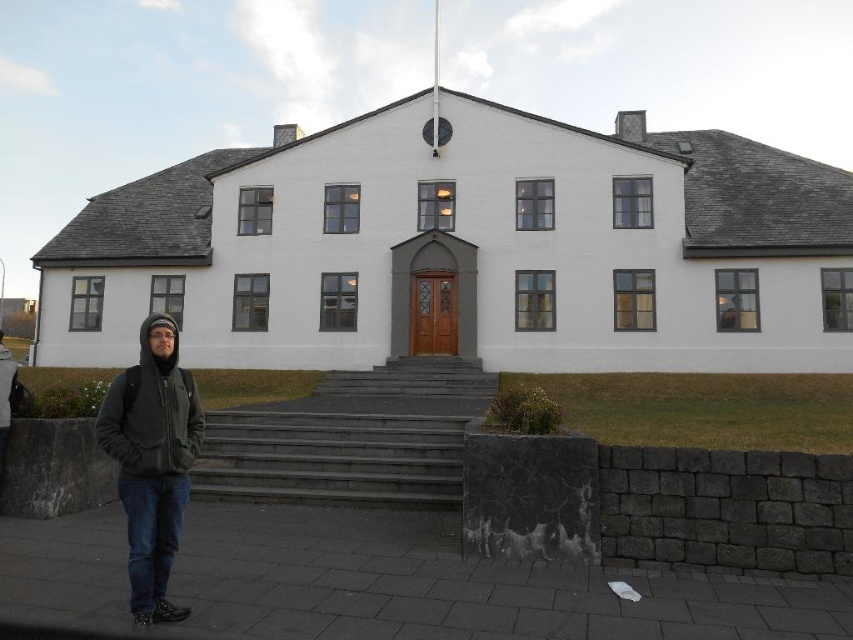
Who is lower down, white matte building at center or dark gray hoodie at lower left?

Positioned lower is dark gray hoodie at lower left.

Is white matte building at center below dark gray hoodie at lower left?

No, white matte building at center is not below dark gray hoodie at lower left.

Which is in front, point (577, 150) or point (189, 385)?

Point (189, 385)

Identify the location of white matte building at center. (x=467, y=248).

Image resolution: width=853 pixels, height=640 pixels. I want to click on white matte building at center, so click(x=467, y=248).

What do you see at coordinates (467, 248) in the screenshot? I see `white matte building at center` at bounding box center [467, 248].

In order to click on white matte building at center in this screenshot , I will do `click(467, 248)`.

What are the coordinates of `white matte building at center` in the screenshot? It's located at (467, 248).

Can you confirm if dark gray concrete stairs at center is bigger than dark gray hoodie at lower left?

Indeed, dark gray concrete stairs at center has a larger size compared to dark gray hoodie at lower left.

Describe the element at coordinates (350, 436) in the screenshot. I see `dark gray concrete stairs at center` at that location.

Who is more forward, [316,388] or [157,412]?

Point [157,412] is in front.

At what (x,y) coordinates should I click in order to perform the action: click on dark gray concrete stairs at center. Please return your answer as a coordinate pair (x, y). This screenshot has height=640, width=853. Looking at the image, I should click on (350, 436).